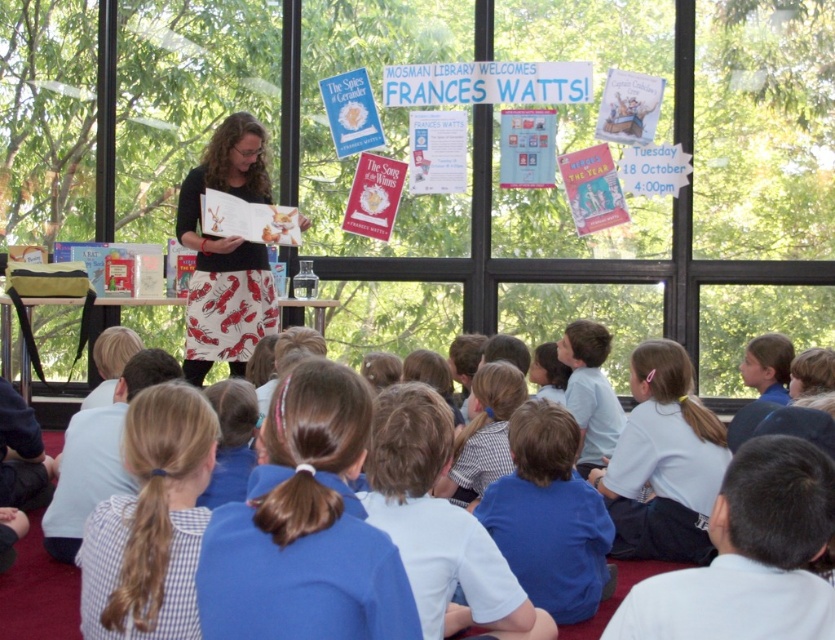
Question: Which of the following is the closest to the observer?

Choices:
 (A) printed cotton skirt at center
 (B) matte paper book at center
 (C) blue gingham shirt at lower left
 (D) blue fabric shirt at center

Answer: (C)

Question: Does transparent glass window at upper center appear under printed cotton skirt at center?

Choices:
 (A) yes
 (B) no

Answer: (B)

Question: Estimate the real-world distances between objects in this image. Which object is farther from the blue fabric ponytail at center?

Choices:
 (A) matte paper book at center
 (B) white uniform at center
 (C) transparent glass window at upper center

Answer: (C)

Question: Is white uniform at center wider than printed cotton skirt at center?

Choices:
 (A) yes
 (B) no

Answer: (B)

Question: Which point appears farthest from the camera in this image?

Choices:
 (A) (385, 35)
 (B) (133, 467)

Answer: (A)

Question: Does blue fabric ponytail at center have a larger size compared to blue fabric shirt at center?

Choices:
 (A) yes
 (B) no

Answer: (B)